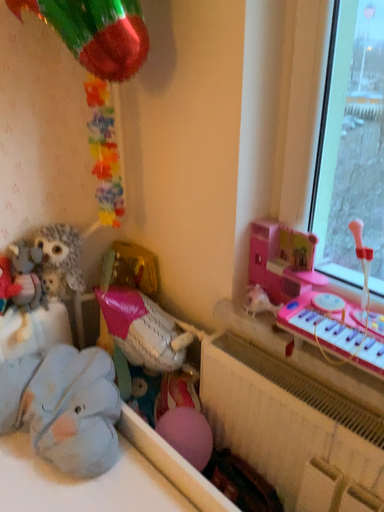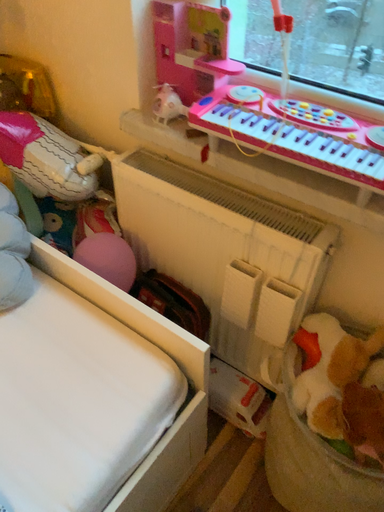
Question: How did the camera likely rotate when shooting the video?

Choices:
 (A) rotated right
 (B) rotated left

Answer: (A)